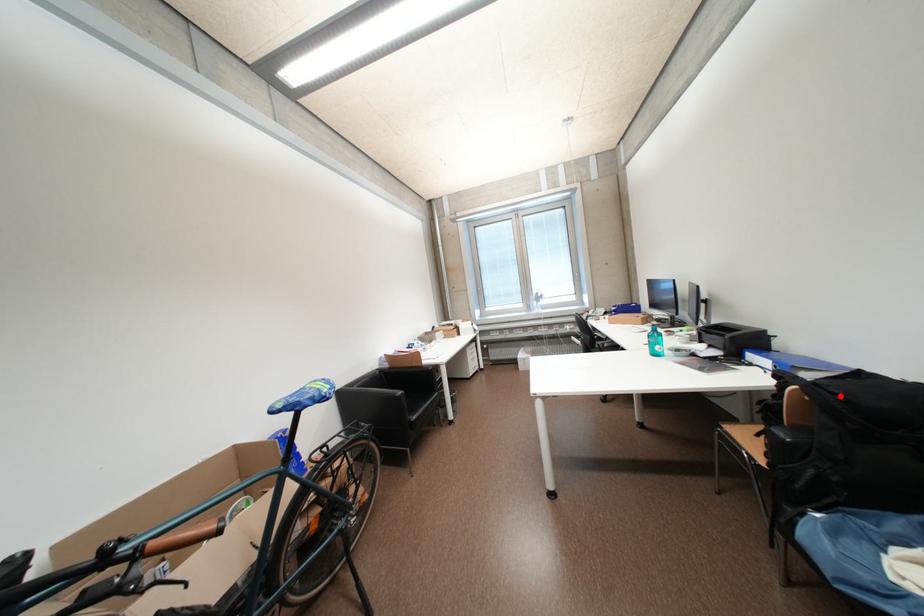
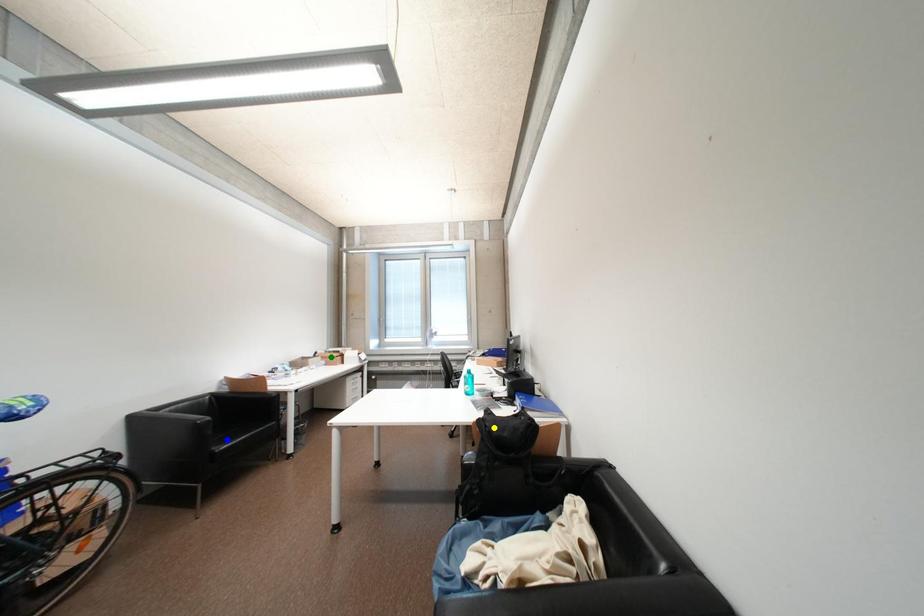
Question: I am providing you with two images of the same scene from different viewpoints. A red point is marked on the first image. You are given multiple points on the second image. Which point in image 2 represents the same 3d spot as the red point in image 1?

Choices:
 (A) yellow point
 (B) green point
 (C) blue point

Answer: (A)